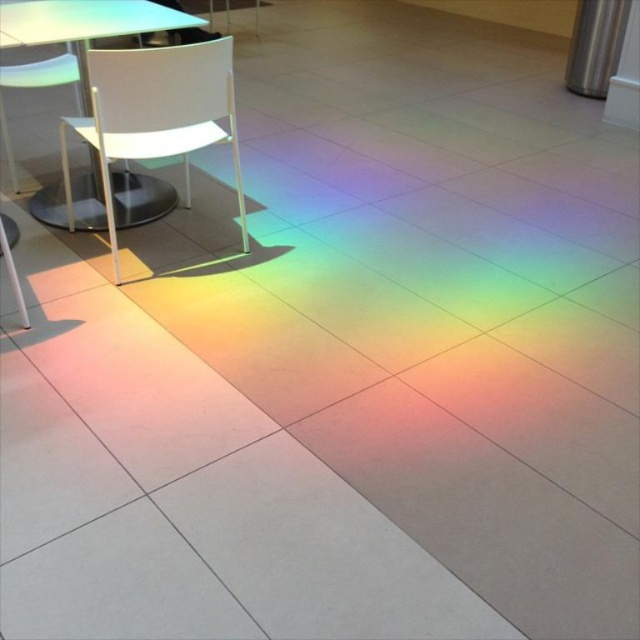
You are a person who is 6 feet tall and standing in the room with the white plastic chair at upper left and the white plastic table at upper left. You want to place a 12 inch tall potted plant on the table. Can you determine if the potted plant will fit on the table without exceeding the table height?

The distance between the white plastic chair at upper left and white plastic table at upper left is 11.29 inches. However, this distance refers to the space between the two objects, not the height of the table. Since the question is about the height of the table, there is insufficient information provided to determine if the 12 inch tall potted plant will fit without exceeding the table height.

You are planning to place a small potted plant between the white plastic chair at upper left and the white plastic table at upper left. Based on their widths, which object should you place closer to the center of the room to ensure the plant has enough space?

The white plastic chair at upper left might be wider than the white plastic table at upper left, so placing the chair closer to the center would leave more space for the plant between them.

In the scene shown: You are standing in the room with the colorful tiled floor and see two points marked on the floor. The first point is at coordinates point (112,256) and the second is at point (24,28). Which point is closer to you?

Point (112,256) is further to the camera than point (24,28), so the point closer to you is point (24,28).